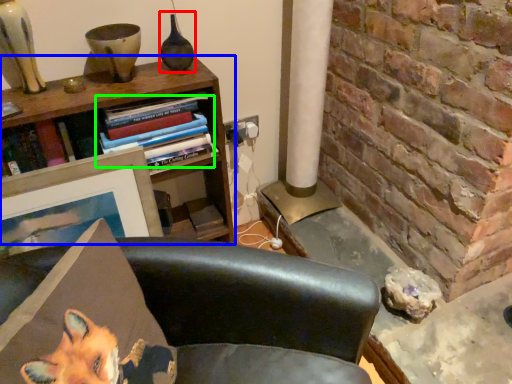
Question: Which is nearer to the vase (highlighted by a red box)? bookcase (highlighted by a blue box) or book (highlighted by a green box).

Choices:
 (A) bookcase
 (B) book

Answer: (B)